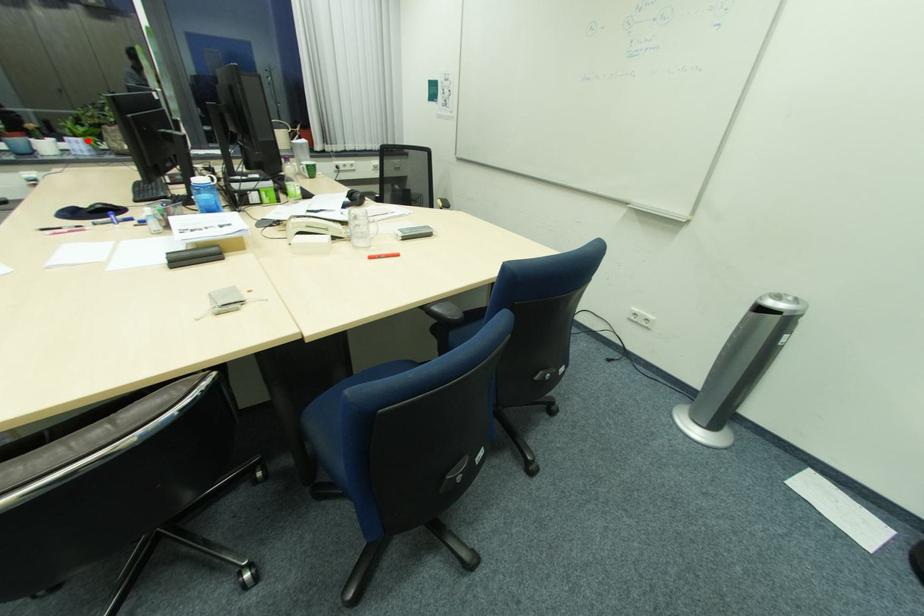
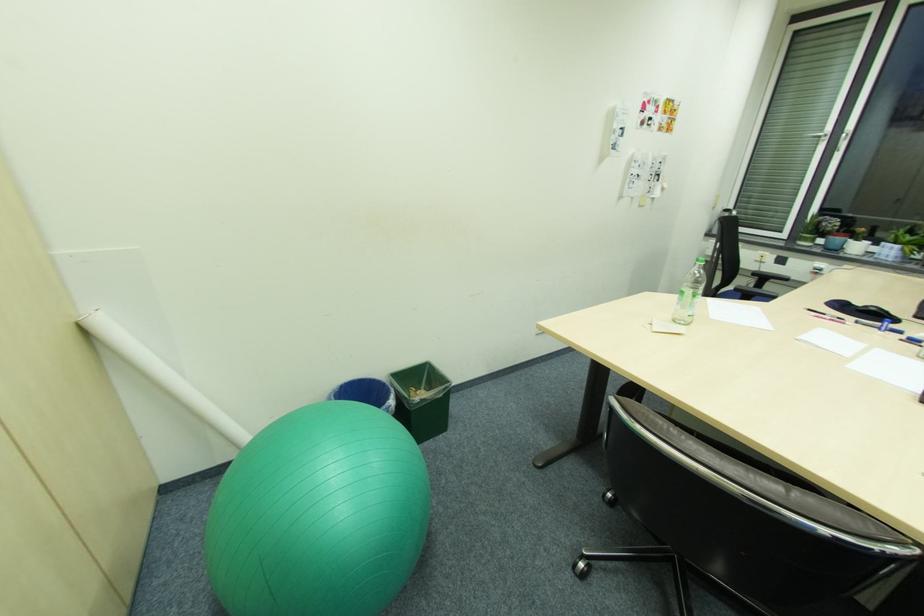
Locate, in the second image, the point that corresponds to the highlighted location in the first image.

(903, 246)